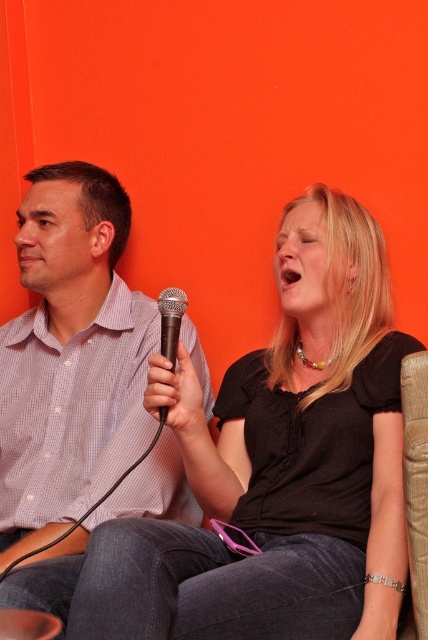
You are designing a display case for a music exhibit and need to know the relative sizes of the matte black microphone at center and the checkered fabric shirt at left. Which object is wider?

The matte black microphone at center is wider than the checkered fabric shirt at left.